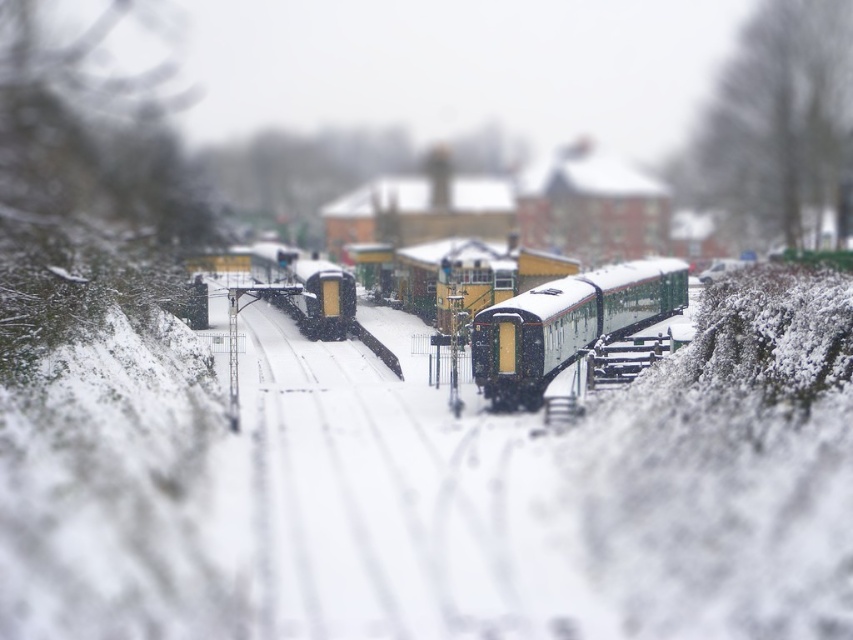
Question: Is green matte train at center to the left of yellow matte train at center from the viewer's perspective?

Choices:
 (A) yes
 (B) no

Answer: (B)

Question: Which of the following is the farthest from the observer?

Choices:
 (A) (618, 280)
 (B) (281, 298)

Answer: (B)

Question: Does green matte train at center have a smaller size compared to yellow matte train at center?

Choices:
 (A) no
 (B) yes

Answer: (A)

Question: Which point is closer to the camera taking this photo?

Choices:
 (A) (352, 282)
 (B) (647, 284)

Answer: (B)

Question: Is green matte train at center to the left of yellow matte train at center from the viewer's perspective?

Choices:
 (A) no
 (B) yes

Answer: (A)